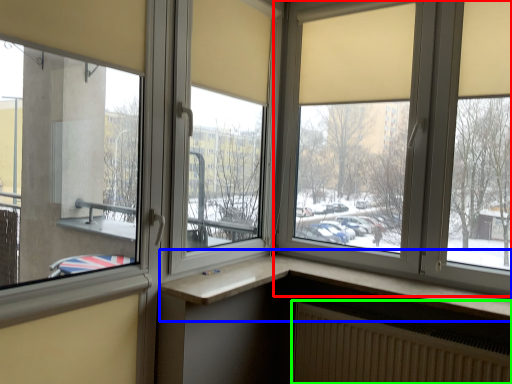
Question: Based on their relative distances, which object is farther from window (highlighted by a red box)? Choose from window (highlighted by a blue box) and radiator (highlighted by a green box).

Choices:
 (A) window
 (B) radiator

Answer: (B)